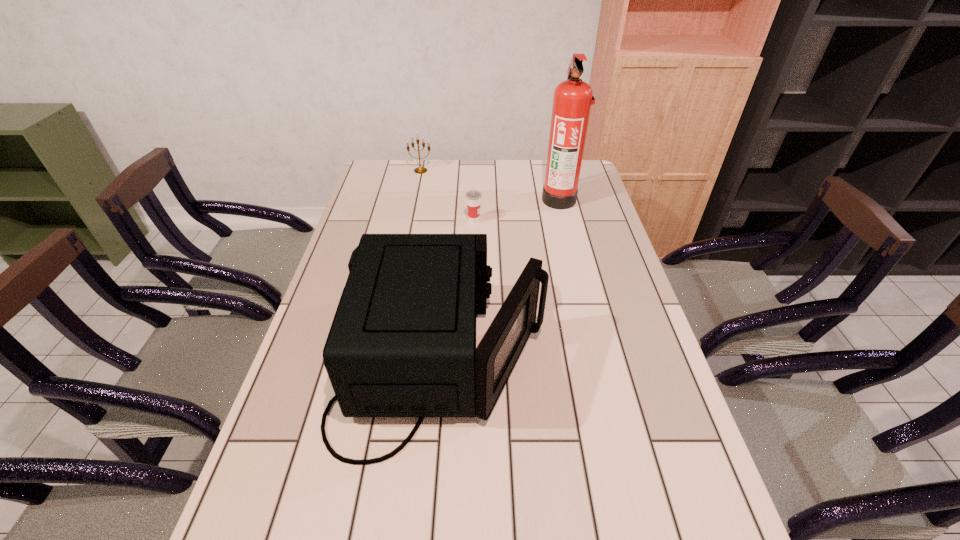
Where is `free space that is in between the third shortest object and the fire extinguisher`? The image size is (960, 540). free space that is in between the third shortest object and the fire extinguisher is located at coordinates (500, 281).

At what (x,y) coordinates should I click in order to perform the action: click on the second closest object to the microwave oven. Please return your answer as a coordinate pair (x, y). Image resolution: width=960 pixels, height=540 pixels. Looking at the image, I should click on (572, 101).

Select which object appears as the third closest to the second nearest object. Please provide its 2D coordinates. Your answer should be formatted as a tuple, i.e. [(x, y)], where the tuple contains the x and y coordinates of a point satisfying the conditions above.

[(419, 170)]